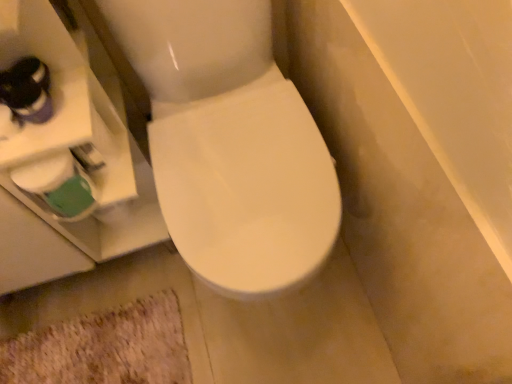
Question: Considering the relative positions of beige shaggy bath mat at lower left and white matte toilet paper at lower left in the image provided, is beige shaggy bath mat at lower left to the left of white matte toilet paper at lower left from the viewer's perspective?

Choices:
 (A) no
 (B) yes

Answer: (B)

Question: Is beige shaggy bath mat at lower left closer to camera compared to white matte toilet paper at lower left?

Choices:
 (A) no
 (B) yes

Answer: (A)

Question: Is beige shaggy bath mat at lower left with white matte toilet paper at lower left?

Choices:
 (A) yes
 (B) no

Answer: (B)

Question: Is beige shaggy bath mat at lower left bigger than white matte toilet paper at lower left?

Choices:
 (A) no
 (B) yes

Answer: (B)

Question: Is the position of beige shaggy bath mat at lower left more distant than that of white matte toilet paper at lower left?

Choices:
 (A) no
 (B) yes

Answer: (B)

Question: Is beige shaggy bath mat at lower left not within white matte toilet paper at lower left?

Choices:
 (A) yes
 (B) no

Answer: (A)

Question: Is white matte toilet paper at lower left aimed at beige shaggy bath mat at lower left?

Choices:
 (A) no
 (B) yes

Answer: (A)

Question: Is white matte toilet paper at lower left in front of beige shaggy bath mat at lower left?

Choices:
 (A) no
 (B) yes

Answer: (B)

Question: Considering the relative sizes of white matte toilet paper at lower left and beige shaggy bath mat at lower left in the image provided, is white matte toilet paper at lower left bigger than beige shaggy bath mat at lower left?

Choices:
 (A) yes
 (B) no

Answer: (B)

Question: From the image's perspective, would you say white matte toilet paper at lower left is positioned over beige shaggy bath mat at lower left?

Choices:
 (A) yes
 (B) no

Answer: (A)

Question: Is white matte toilet paper at lower left smaller than beige shaggy bath mat at lower left?

Choices:
 (A) yes
 (B) no

Answer: (A)

Question: Can beige shaggy bath mat at lower left be found inside white matte toilet paper at lower left?

Choices:
 (A) no
 (B) yes

Answer: (A)

Question: Does point (46, 160) appear closer or farther from the camera than point (155, 332)?

Choices:
 (A) farther
 (B) closer

Answer: (B)